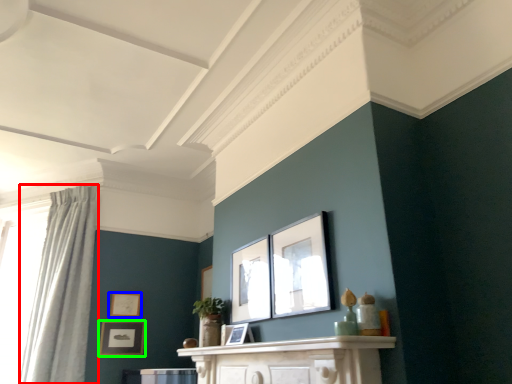
Question: Considering the real-world distances, which object is farthest from curtain (highlighted by a red box)? picture frame (highlighted by a blue box) or picture frame (highlighted by a green box)?

Choices:
 (A) picture frame
 (B) picture frame

Answer: (A)